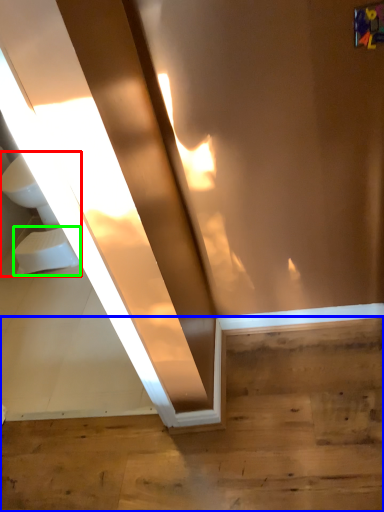
Question: Which is nearer to the sink (highlighted by a red box)? stairwell (highlighted by a blue box) or toilet bowl (highlighted by a green box).

Choices:
 (A) stairwell
 (B) toilet bowl

Answer: (B)